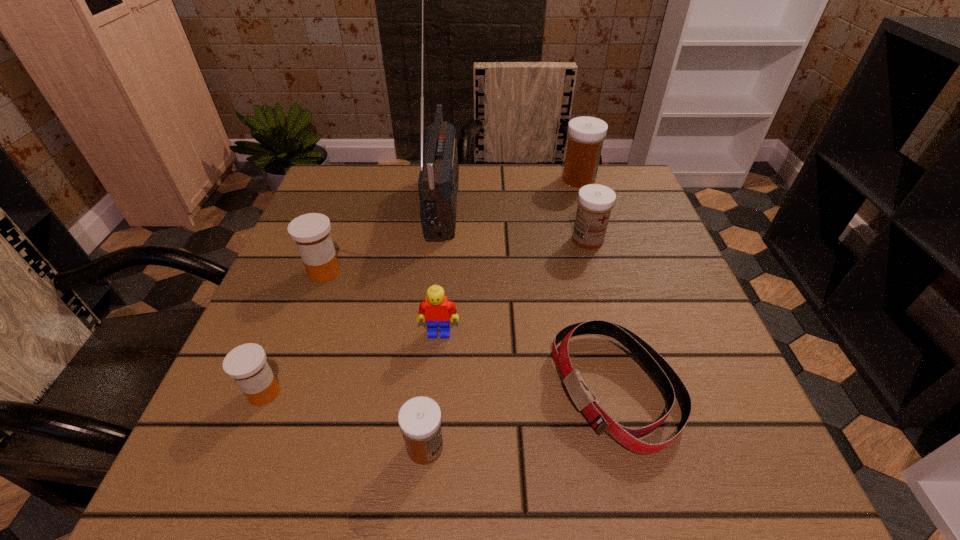
Identify the location of white medicine that stands as the third closest to the Lego. This screenshot has width=960, height=540. (586, 134).

Identify the location of vacant position in the image that satisfies the following two spatial constraints: 1. on the front-facing side of the radio receiver; 2. on the label of the smaller orange medicine. (423, 393).

Locate an element on the screen. vacant space that satisfies the following two spatial constraints: 1. on the front side of the second farthest medicine; 2. on the label of the bigger orange medicine is located at coordinates (596, 272).

Locate an element on the screen. Image resolution: width=960 pixels, height=540 pixels. vacant region that satisfies the following two spatial constraints: 1. on the back side of the tallest medicine; 2. on the left side of the shortest object is located at coordinates (563, 179).

At what (x,y) coordinates should I click in order to perform the action: click on free point that satisfies the following two spatial constraints: 1. on the front-facing side of the radio receiver; 2. on the label of the smaller orange medicine. Please return your answer as a coordinate pair (x, y). Looking at the image, I should click on (423, 393).

Image resolution: width=960 pixels, height=540 pixels. Find the location of `free point that satisfies the following two spatial constraints: 1. on the front side of the seventh shortest object; 2. on the front-facing side of the tallest object`. free point that satisfies the following two spatial constraints: 1. on the front side of the seventh shortest object; 2. on the front-facing side of the tallest object is located at coordinates (586, 201).

This screenshot has width=960, height=540. What are the coordinates of `free space in the image that satisfies the following two spatial constraints: 1. on the front-facing side of the tallest object; 2. on the back side of the second farthest medicine` in the screenshot? It's located at (440, 240).

Locate an element on the screen. The width and height of the screenshot is (960, 540). vacant area in the image that satisfies the following two spatial constraints: 1. on the front-facing side of the second farthest white medicine; 2. on the right side of the tallest object is located at coordinates (440, 240).